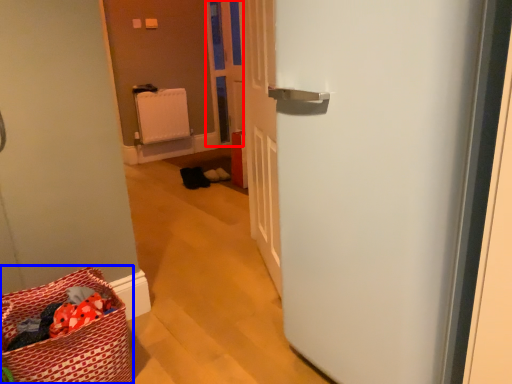
Question: Among these objects, which one is nearest to the camera, screen door (highlighted by a red box) or laundry basket (highlighted by a blue box)?

Choices:
 (A) screen door
 (B) laundry basket

Answer: (B)